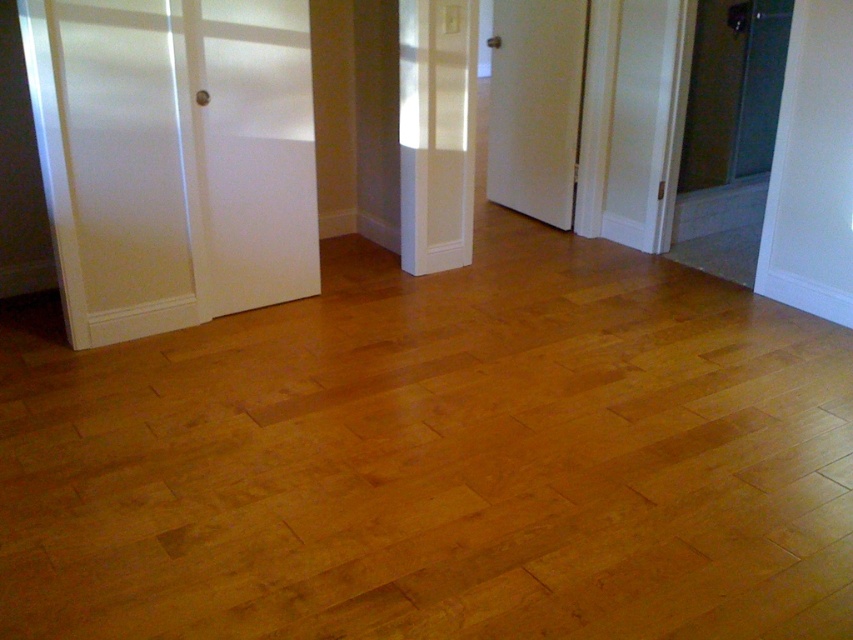
From the picture: Which is above, white glossy door at left or white matte door at center?

white matte door at center is higher up.

Who is more distant from viewer, (291,109) or (436,256)?

The point (436,256) is behind.

Locate an element on the screen. The height and width of the screenshot is (640, 853). white glossy door at left is located at coordinates (173, 157).

Based on the photo, is white matte door at center thinner than white wood door at center?

Yes, white matte door at center is thinner than white wood door at center.

Describe the element at coordinates (436, 132) in the screenshot. I see `white matte door at center` at that location.

Who is more distant from viewer, (445,131) or (515,177)?

The point (515,177) is behind.

This screenshot has height=640, width=853. Identify the location of white matte door at center. (436, 132).

Is white glossy door at left closer to camera compared to white wood door at center?

Yes.

Describe the element at coordinates (173, 157) in the screenshot. The height and width of the screenshot is (640, 853). I see `white glossy door at left` at that location.

Locate an element on the screen. Image resolution: width=853 pixels, height=640 pixels. white glossy door at left is located at coordinates (173, 157).